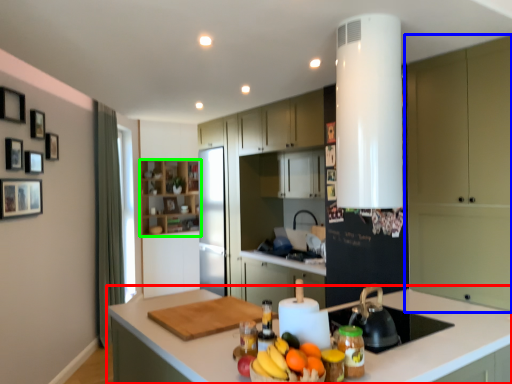
Question: Estimate the real-world distances between objects in this image. Which object is farther from countertop (highlighted by a red box), cabinetry (highlighted by a blue box) or cabinetry (highlighted by a green box)?

Choices:
 (A) cabinetry
 (B) cabinetry

Answer: (B)